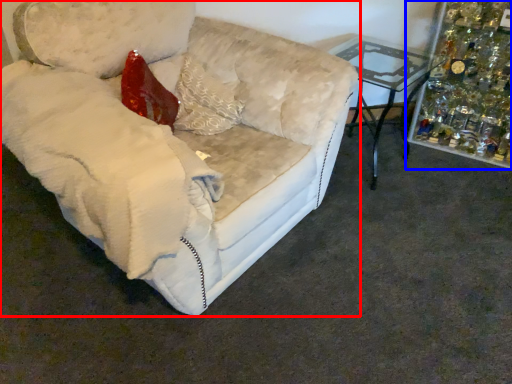
Question: Which object appears farthest to the camera in this image, studio couch (highlighted by a red box) or christmas decoration (highlighted by a blue box)?

Choices:
 (A) studio couch
 (B) christmas decoration

Answer: (B)